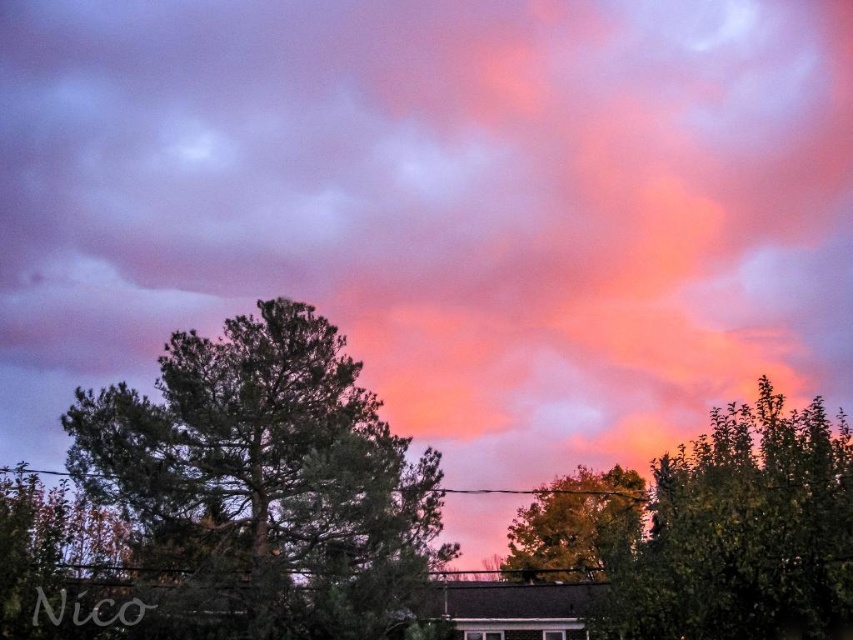
How far apart are green leafy tree at upper center and green leafy tree at center?

They are 10.81 meters apart.

You are a GUI agent. You are given a task and a screenshot of the screen. Output one action in this format:
    pyautogui.click(x=<x>, y=<y>)
    Task: Click on the green leafy tree at upper center
    
    Given the screenshot: What is the action you would take?
    pyautogui.click(x=743, y=532)

Where is `green leafy tree at upper center`? green leafy tree at upper center is located at coordinates (743, 532).

Between green needle-like at center and green leafy tree at upper center, which one is positioned higher?

green needle-like at center is higher up.

Which is more to the right, green needle-like at center or green leafy tree at upper center?

Positioned to the right is green leafy tree at upper center.

Is point (181, 380) closer to camera compared to point (751, 573)?

No, (181, 380) is further to viewer.

Identify the location of green needle-like at center. This screenshot has width=853, height=640. (265, 481).

Is green needle-like at center shorter than green leafy tree at center?

Incorrect, green needle-like at center's height does not fall short of green leafy tree at center's.

Is point (258, 312) positioned behind point (519, 568)?

No, it is in front of (519, 568).

The image size is (853, 640). What do you see at coordinates (265, 481) in the screenshot?
I see `green needle-like at center` at bounding box center [265, 481].

Identify the location of green needle-like at center. The image size is (853, 640). (265, 481).